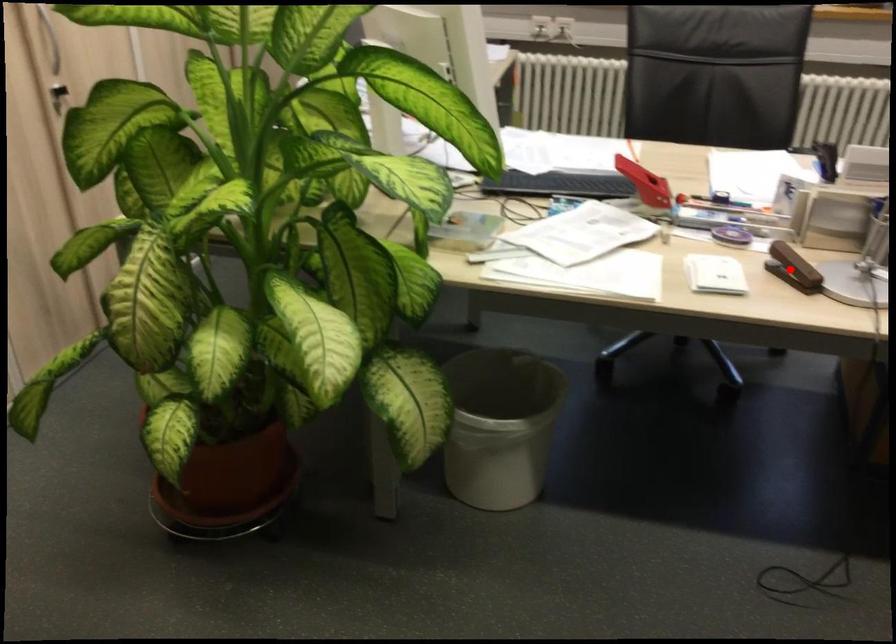
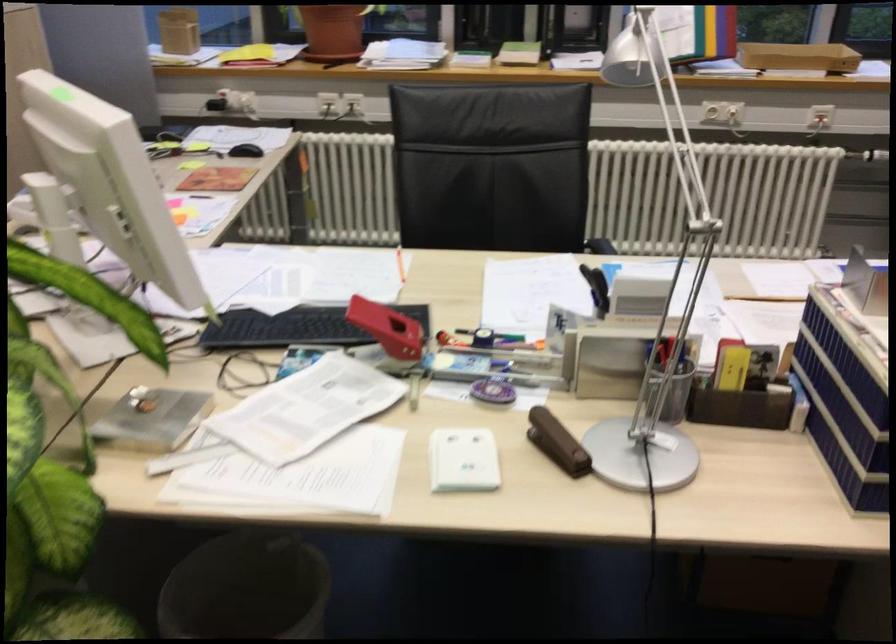
Question: A red point is marked in image1. In image2, is the corresponding 3D point closer to the camera or farther? Reply with the corresponding letter.

Choices:
 (A) The corresponding 3D point is closer.
 (B) The corresponding 3D point is farther.

Answer: (A)